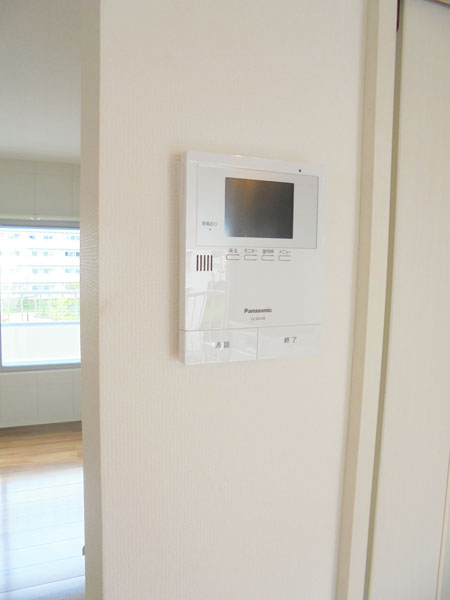
At what (x,y) coordinates should I click in order to perform the action: click on lcd screen. Please return your answer as a coordinate pair (x, y). The height and width of the screenshot is (600, 450). Looking at the image, I should click on (276, 289), (256, 309), (260, 213).